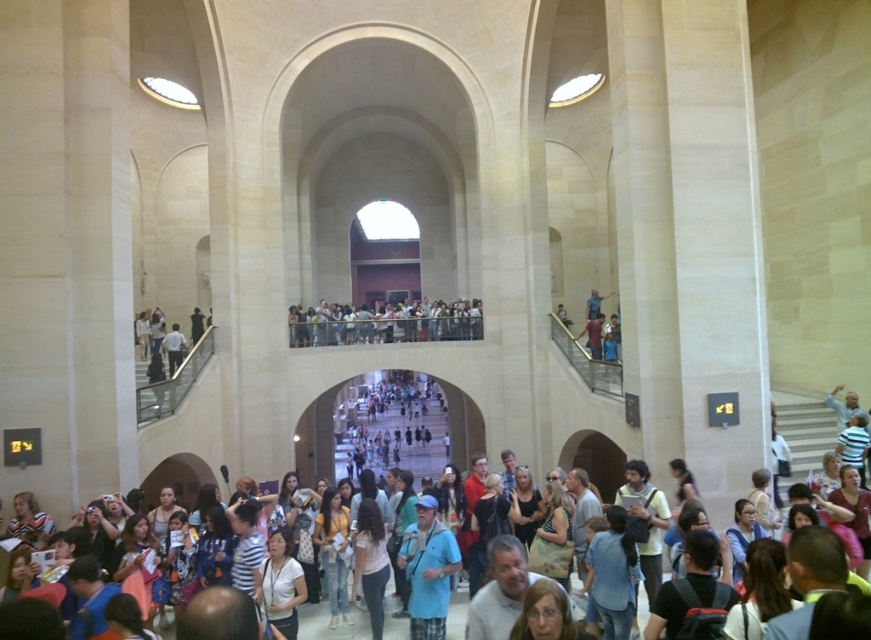
You are standing at the entrance of the grand historic building and see the blue plaid shirt at center. If you want to reach the balcony, which is located at point 0.9, 0.5, can you directly walk there from your current position?

The blue plaid shirt at center is at point (429,570), which is very close to the balcony at (435,576). Since the coordinates are nearly the same, you can directly walk to the balcony from your current position.

You are standing in the grand historic building and want to move from point A to point B. Point A is located at coordinates point (434, 524) and point B is at point (377, 612). Which point is closer to you when you are facing the entrance?

Point (434, 524) is closer to you than point (377, 612) because it is further to the viewer according to their positions in the image.

You are a visitor in this grand historic building and you want to take a photo of both the blue plaid shirt at center and the light pink fabric at center in the same frame. What is the minimum distance you need to move back to ensure both objects fit in your camera view?

The blue plaid shirt at center and light pink fabric at center are 9.63 feet apart from each other. To capture both in the same frame, you need to move back at least 9.63 feet so that the camera can encompass the entire distance between them.